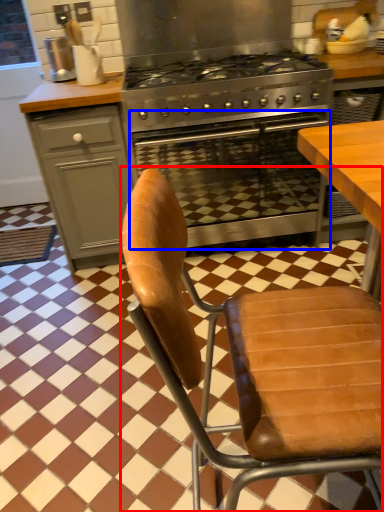
Question: Which object is closer to the camera taking this photo, chair (highlighted by a red box) or oven (highlighted by a blue box)?

Choices:
 (A) chair
 (B) oven

Answer: (A)